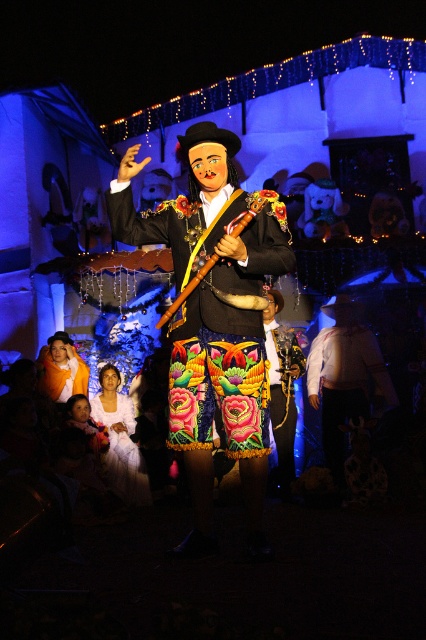
Question: Which of these objects is positioned closest to the orange fabric at center?

Choices:
 (A) velvet floral skirt at center
 (B) matte black mariachi at center
 (C) wooden flute at center

Answer: (C)

Question: Which point is farther from the camera taking this photo?

Choices:
 (A) (213, 253)
 (B) (278, 301)
 (C) (45, 381)
 (D) (241, 292)

Answer: (B)

Question: Does velvet floral skirt at center have a larger size compared to orange fabric at center?

Choices:
 (A) no
 (B) yes

Answer: (B)

Question: Is matte black mariachi at center bigger than orange fabric at center?

Choices:
 (A) no
 (B) yes

Answer: (B)

Question: From the image, what is the correct spatial relationship of matte black mariachi at center in relation to orange fabric at center?

Choices:
 (A) right
 (B) left

Answer: (A)

Question: Which of these objects is positioned closest to the velvet floral skirt at center?

Choices:
 (A) wooden flute at center
 (B) matte black mariachi at center
 (C) orange fabric at center

Answer: (B)